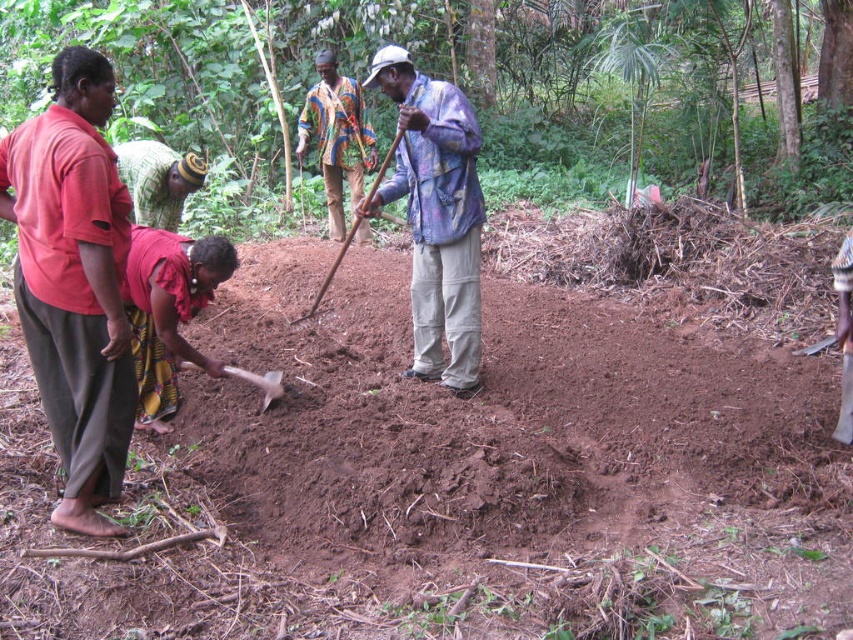
Question: Among these points, which one is nearest to the camera?

Choices:
 (A) (660, 49)
 (B) (393, 80)
 (C) (84, 440)
 (D) (592, 566)

Answer: (D)

Question: Which object is farther from the camera taking this photo?

Choices:
 (A) multicolored fabric shirt at center
 (B) printed fabric shirt at center
 (C) wooden shovel at center
 (D) brown soil at center

Answer: (A)

Question: Does multicolored fabric shirt at center lie behind wooden shovel at center?

Choices:
 (A) no
 (B) yes

Answer: (B)

Question: Is brown dirt at center closer to camera compared to multicolored fabric shirt at center?

Choices:
 (A) yes
 (B) no

Answer: (A)

Question: Which point appears closest to the camera in this image?

Choices:
 (A) (24, 630)
 (B) (86, 516)
 (C) (221, 275)
 (D) (329, 273)

Answer: (A)

Question: Is printed fabric shirt at center above wooden shovel at center?

Choices:
 (A) yes
 (B) no

Answer: (A)